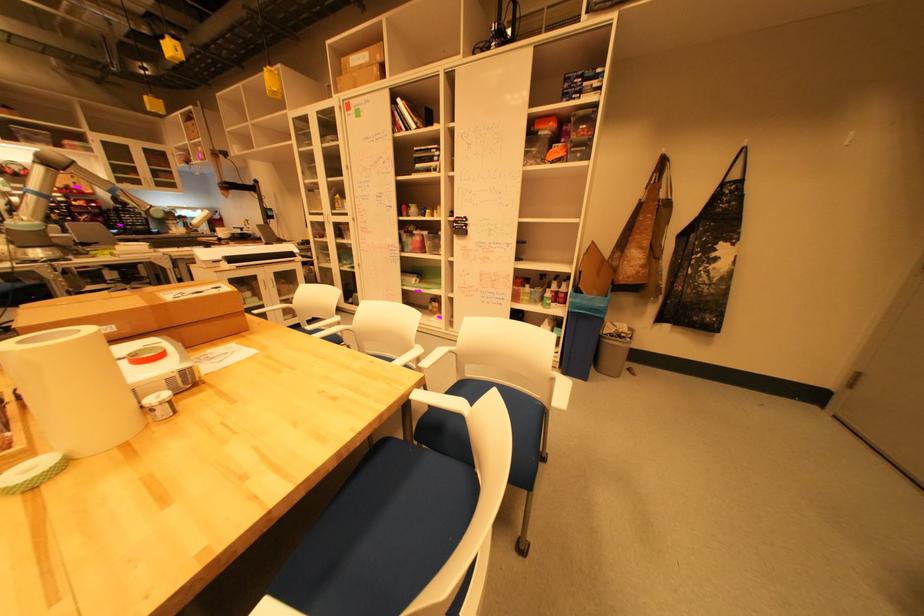
Image resolution: width=924 pixels, height=616 pixels. I want to click on large white roll, so click(x=73, y=389).